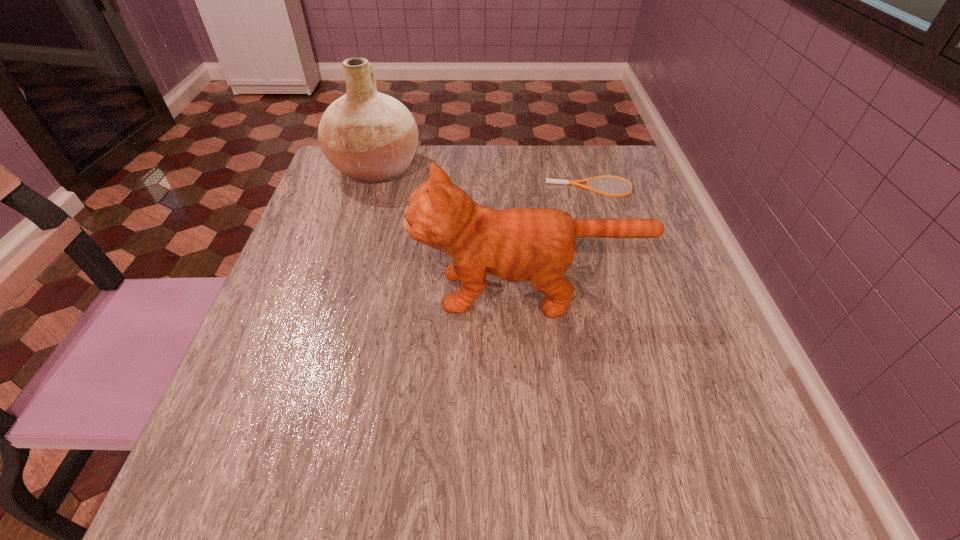
Where is `object present at the left edge`? The height and width of the screenshot is (540, 960). object present at the left edge is located at coordinates (371, 137).

This screenshot has width=960, height=540. In order to click on cat at the right edge in this screenshot , I will do `click(518, 244)`.

Identify the location of tennis racket situated at the right edge. This screenshot has width=960, height=540. (554, 181).

The height and width of the screenshot is (540, 960). Find the location of `object at the far left corner`. object at the far left corner is located at coordinates (371, 137).

What are the coordinates of `object that is at the far right corner` in the screenshot? It's located at (554, 181).

In the image, there is a desktop. Identify the location of free region at the far edge. (517, 168).

This screenshot has height=540, width=960. What are the coordinates of `vacant space at the near edge of the desktop` in the screenshot? It's located at (480, 496).

Find the location of `vacant area at the left edge`. vacant area at the left edge is located at coordinates (283, 418).

What are the coordinates of `vacant space at the right edge of the desktop` in the screenshot? It's located at (643, 217).

Image resolution: width=960 pixels, height=540 pixels. I want to click on free space at the near left corner of the desktop, so click(x=276, y=474).